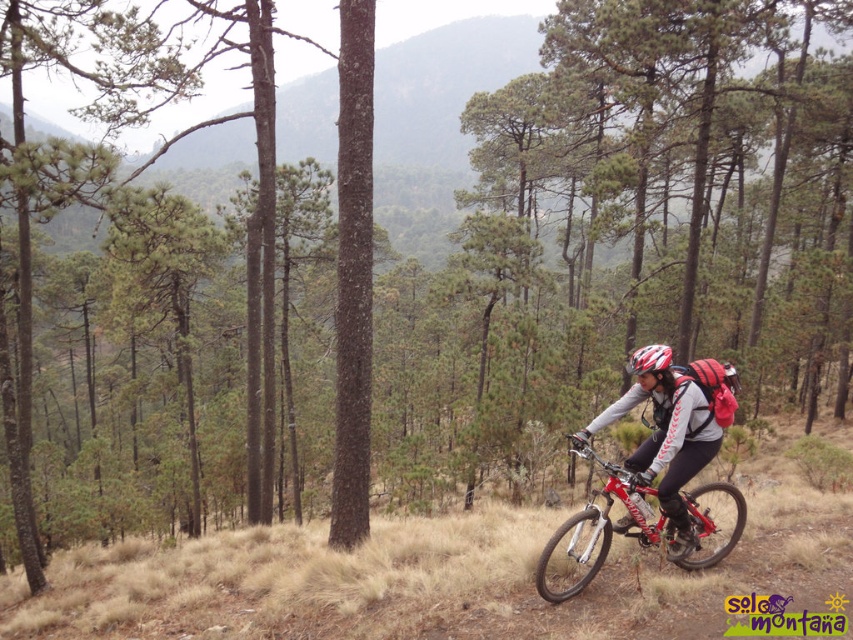
You are a photographer positioned at the scene wanting to capture a photo of both the matte black helmet at center and the shiny metallic bicycle at right. Which object will appear larger in the photo?

The matte black helmet at center will appear larger in the photo because it is closer to the photographer than the shiny metallic bicycle at right.

You are a mountain biker looking at your gear. You notice two helmets in the image. Which helmet is positioned lower on your body, the matte black helmet at center or the matte white helmet at center?

The matte black helmet at center is positioned lower on your body because it is below the matte white helmet at center.